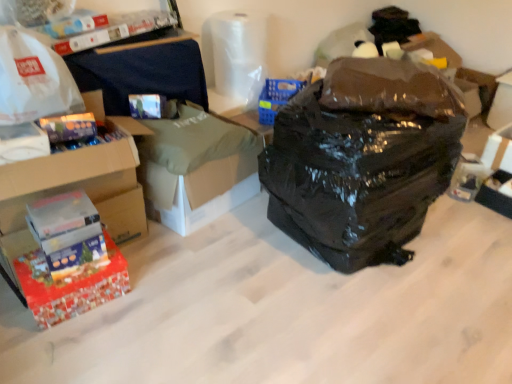
The image size is (512, 384). Describe the element at coordinates (196, 168) in the screenshot. I see `white cardboard box at center` at that location.

The height and width of the screenshot is (384, 512). Find the location of `white matte plastic bag at upper left`. white matte plastic bag at upper left is located at coordinates (33, 79).

You are a GUI agent. You are given a task and a screenshot of the screen. Output one action in this format:
    pyautogui.click(x=<x>, y=<y>)
    Task: Click on the matte cardboard box at lower left, arranged as the 1th box when viewed from the top
    This screenshot has height=384, width=512.
    Given the screenshot: What is the action you would take?
    pyautogui.click(x=22, y=142)

Image resolution: width=512 pixels, height=384 pixels. What are the coordinates of `red cardboard box at lower left, which is the second box in top-to-bottom order` in the screenshot? It's located at (82, 178).

Locate an element on the screen. Image resolution: width=512 pixels, height=384 pixels. black plastic storage box at lower right, which ranks as the 1th storage box in bottom-to-top order is located at coordinates [x=496, y=193].

Is transparent plastic toilet paper at upper center far from black plastic bag at center?

transparent plastic toilet paper at upper center is positioned a significant distance from black plastic bag at center.

How much distance is there between transparent plastic toilet paper at upper center and black plastic bag at center?

They are 3.79 feet apart.

From a real-world perspective, between transparent plastic toilet paper at upper center and black plastic bag at center, who is vertically higher?

transparent plastic toilet paper at upper center, from a real-world perspective.

Is transparent plastic toilet paper at upper center turned away from black plastic bag at center?

No, transparent plastic toilet paper at upper center's orientation is not away from black plastic bag at center.

Which of these two, red glossy box at lower left, the third box positioned from the top, or black plastic storage box at upper right, the 1th storage box viewed from the back, is bigger?

black plastic storage box at upper right, the 1th storage box viewed from the back.

From the image's perspective, between red glossy box at lower left, the third box positioned from the top, and black plastic storage box at upper right, which is the third storage box from front to back, who is located below?

From the image's view, red glossy box at lower left, the third box positioned from the top, is below.

Considering the relative sizes of red glossy box at lower left, the 1th box from the bottom, and black plastic storage box at upper right, the 1th storage box viewed from the back, in the image provided, is red glossy box at lower left, the 1th box from the bottom, thinner than black plastic storage box at upper right, the 1th storage box viewed from the back,?

Correct, the width of red glossy box at lower left, the 1th box from the bottom, is less than that of black plastic storage box at upper right, the 1th storage box viewed from the back.

In the scene shown: Is red glossy box at lower left, the 1th box from the bottom, oriented away from black plastic storage box at upper right, the 1th storage box positioned from the top?

red glossy box at lower left, the 1th box from the bottom, is not turned away from black plastic storage box at upper right, the 1th storage box positioned from the top.

Would you say red glossy box at lower left, the 1th box from the bottom, is part of white cardboard box at center's contents?

No, red glossy box at lower left, the 1th box from the bottom, is not inside white cardboard box at center.

This screenshot has width=512, height=384. Identify the location of box that is the 2nd object located below the white cardboard box at center (from the image's perspective). (63, 282).

Considering the sizes of objects white cardboard box at center and red glossy box at lower left, the third box positioned from the top, in the image provided, who is thinner, white cardboard box at center or red glossy box at lower left, the third box positioned from the top,?

red glossy box at lower left, the third box positioned from the top, is thinner.

Is white cardboard box at center far away from red glossy box at lower left, the third box positioned from the top?

That's not correct — white cardboard box at center is a little close to red glossy box at lower left, the third box positioned from the top.

Is white cardboard box at right, acting as the second storage box starting from the back, completely or partially outside of white matte plastic bag at upper left?

white cardboard box at right, acting as the second storage box starting from the back, lies outside white matte plastic bag at upper left's area.

You are a GUI agent. You are given a task and a screenshot of the screen. Output one action in this format:
    pyautogui.click(x=<x>, y=<y>)
    Task: Click on the plastic bag in front of the white cardboard box at right, the second storage box from the bottom
    The width and height of the screenshot is (512, 384).
    Given the screenshot: What is the action you would take?
    pyautogui.click(x=33, y=79)

From the image's perspective, is white cardboard box at right, acting as the second storage box starting from the back, over white matte plastic bag at upper left?

Actually, white cardboard box at right, acting as the second storage box starting from the back, appears below white matte plastic bag at upper left in the image.

Is white cardboard box at right, placed as the second storage box when sorted from top to bottom, to the left of white matte plastic bag at upper left from the viewer's perspective?

In fact, white cardboard box at right, placed as the second storage box when sorted from top to bottom, is to the right of white matte plastic bag at upper left.

Is white cardboard box at right, the 2th storage box from the front, thinner than matte cardboard box at lower left, acting as the third box starting from the bottom?

In fact, white cardboard box at right, the 2th storage box from the front, might be wider than matte cardboard box at lower left, acting as the third box starting from the bottom.

Which object is closer to the camera, white cardboard box at right, the 2th storage box from the front, or matte cardboard box at lower left, acting as the third box starting from the bottom?

matte cardboard box at lower left, acting as the third box starting from the bottom, is in front.

What's the angular difference between white cardboard box at right, acting as the second storage box starting from the back, and matte cardboard box at lower left, acting as the third box starting from the bottom,'s facing directions?

89.1 degrees separate the facing orientations of white cardboard box at right, acting as the second storage box starting from the back, and matte cardboard box at lower left, acting as the third box starting from the bottom.

Choose the correct answer: Is white cardboard box at right, placed as the second storage box when sorted from top to bottom, inside matte cardboard box at lower left, arranged as the 1th box when viewed from the top, or outside it?

white cardboard box at right, placed as the second storage box when sorted from top to bottom, cannot be found inside matte cardboard box at lower left, arranged as the 1th box when viewed from the top.

Is red cardboard box at lower left, which is the second box in top-to-bottom order, oriented towards white matte plastic bag at upper left?

No, red cardboard box at lower left, which is the second box in top-to-bottom order, is not facing towards white matte plastic bag at upper left.

Is red cardboard box at lower left, marked as the second box in a bottom-to-top arrangement, bigger or smaller than white matte plastic bag at upper left?

red cardboard box at lower left, marked as the second box in a bottom-to-top arrangement, is bigger than white matte plastic bag at upper left.

Image resolution: width=512 pixels, height=384 pixels. There is a white matte plastic bag at upper left. Find the location of `the 2nd box below it (from a real-world perspective)`. the 2nd box below it (from a real-world perspective) is located at coordinates (82, 178).

From the image's perspective, does red cardboard box at lower left, which is the second box in top-to-bottom order, appear higher than white matte plastic bag at upper left?

Incorrect, from the image's perspective, red cardboard box at lower left, which is the second box in top-to-bottom order, is lower than white matte plastic bag at upper left.

Would you say black plastic storage box at lower right, which ranks as the 3th storage box in top-to-bottom order, is outside transparent plastic toilet paper at upper center?

Yes, black plastic storage box at lower right, which ranks as the 3th storage box in top-to-bottom order, is not within transparent plastic toilet paper at upper center.

Between point (475, 196) and point (254, 28), which one is positioned in front?

The point (475, 196) is in front.

Could you tell me if black plastic storage box at lower right, which ranks as the 1th storage box in bottom-to-top order, is turned towards transparent plastic toilet paper at upper center?

No, black plastic storage box at lower right, which ranks as the 1th storage box in bottom-to-top order, is not oriented towards transparent plastic toilet paper at upper center.

Identify the location of toilet paper above the black plastic bag at center (from a real-world perspective). This screenshot has height=384, width=512. (238, 54).

From a real-world perspective, which box is the 2nd one underneath the black plastic storage box at upper right, the 1th storage box positioned from the top? Please provide its 2D coordinates.

[(63, 282)]

Which object lies further to the anchor point black plastic storage box at upper right, the 1th storage box viewed from the back, red glossy box at lower left, the 1th box from the bottom, or white matte plastic bag at upper left?

red glossy box at lower left, the 1th box from the bottom.

From the image, which object appears to be farther from black plastic storage box at lower right, arranged as the 1th storage box when viewed from the front, transparent plastic toilet paper at upper center or red cardboard box at lower left, which is the second box in top-to-bottom order?

red cardboard box at lower left, which is the second box in top-to-bottom order, is further to black plastic storage box at lower right, arranged as the 1th storage box when viewed from the front.

Looking at the image, which one is located further to white matte plastic bag at upper left, red cardboard box at lower left, which is the second box in top-to-bottom order, or matte cardboard box at lower left, acting as the third box starting from the bottom?

red cardboard box at lower left, which is the second box in top-to-bottom order, is positioned further to the anchor white matte plastic bag at upper left.

Based on their spatial positions, is white cardboard box at right, the 2th storage box from the front, or white cardboard box at center closer to red glossy box at lower left, the third box positioned from the top?

white cardboard box at center is positioned closer to the anchor red glossy box at lower left, the third box positioned from the top.

When comparing their distances from red glossy box at lower left, the 1th box from the bottom, does transparent plastic toilet paper at upper center or black plastic storage box at upper right, the 1th storage box positioned from the top, seem closer?

transparent plastic toilet paper at upper center lies closer to red glossy box at lower left, the 1th box from the bottom, than the other object.

When comparing their distances from red cardboard box at lower left, which is the second box in top-to-bottom order, does white cardboard box at center or matte cardboard box at lower left, arranged as the 1th box when viewed from the top, seem closer?

Based on the image, matte cardboard box at lower left, arranged as the 1th box when viewed from the top, appears to be nearer to red cardboard box at lower left, which is the second box in top-to-bottom order.

Estimate the real-world distances between objects in this image. Which object is closer to white cardboard box at right, acting as the second storage box starting from the back, matte cardboard box at lower left, arranged as the 1th box when viewed from the top, or white cardboard box at center?

white cardboard box at center.

Based on their spatial positions, is black plastic bag at center or matte cardboard box at lower left, arranged as the 1th box when viewed from the top, further from black plastic storage box at lower right, which ranks as the 1th storage box in bottom-to-top order?

matte cardboard box at lower left, arranged as the 1th box when viewed from the top, lies further to black plastic storage box at lower right, which ranks as the 1th storage box in bottom-to-top order, than the other object.

Find the location of a particular element. The image size is (512, 384). toilet paper situated between matte cardboard box at lower left, acting as the third box starting from the bottom, and black plastic bag at center from left to right is located at coordinates (238, 54).

I want to click on garbage between red glossy box at lower left, the 1th box from the bottom, and black plastic storage box at upper right, arranged as the third storage box when ordered from the bottom, in the horizontal direction, so click(362, 159).

You are a GUI agent. You are given a task and a screenshot of the screen. Output one action in this format:
    pyautogui.click(x=<x>, y=<y>)
    Task: Click on the cardboard box between white matte plastic bag at upper left and red glossy box at lower left, the third box positioned from the top, vertically
    The height and width of the screenshot is (384, 512).
    Given the screenshot: What is the action you would take?
    tap(196, 168)

What are the coordinates of `toilet paper between matte cardboard box at lower left, arranged as the 1th box when viewed from the top, and black plastic storage box at lower right, arranged as the 1th storage box when viewed from the front, in the horizontal direction` in the screenshot? It's located at (238, 54).